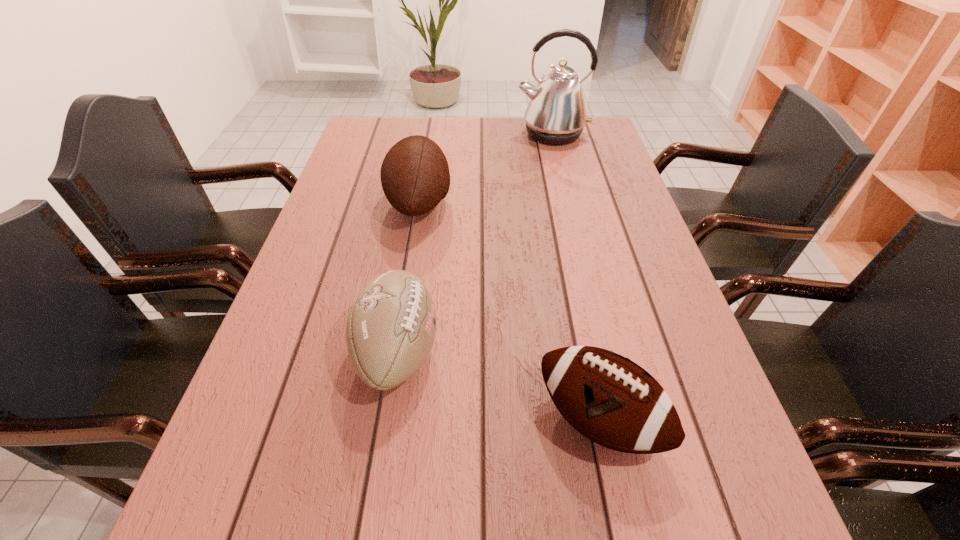
Identify the location of object present at the far right corner. The height and width of the screenshot is (540, 960). (556, 114).

You are a GUI agent. You are given a task and a screenshot of the screen. Output one action in this format:
    pyautogui.click(x=<x>, y=<y>)
    Task: Click on the free space at the far edge of the desktop
    This screenshot has height=540, width=960.
    Given the screenshot: What is the action you would take?
    point(519,146)

You are a GUI agent. You are given a task and a screenshot of the screen. Output one action in this format:
    pyautogui.click(x=<x>, y=<y>)
    Task: Click on the vacant area at the left edge of the desktop
    The image size is (960, 540).
    Given the screenshot: What is the action you would take?
    pyautogui.click(x=357, y=194)

Where is `free region at the right edge of the desktop`? This screenshot has height=540, width=960. free region at the right edge of the desktop is located at coordinates (657, 314).

You are a GUI agent. You are given a task and a screenshot of the screen. Output one action in this format:
    pyautogui.click(x=<x>, y=<y>)
    Task: Click on the vacant area that lies between the rightmost football (American) and the third nearest object
    This screenshot has height=540, width=960.
    Given the screenshot: What is the action you would take?
    [509, 312]

Where is `vacant space in between the rightmost football (American) and the tallest object`? The height and width of the screenshot is (540, 960). vacant space in between the rightmost football (American) and the tallest object is located at coordinates (575, 277).

Where is `object that is the third closest to the rightmost football (American)`? object that is the third closest to the rightmost football (American) is located at coordinates (556, 114).

You are a GUI agent. You are given a task and a screenshot of the screen. Output one action in this format:
    pyautogui.click(x=<x>, y=<y>)
    Task: Click on the closest object to the third nearest object
    The width and height of the screenshot is (960, 540).
    Given the screenshot: What is the action you would take?
    pyautogui.click(x=391, y=327)

Where is `football (American) that stands as the closest to the rightmost football (American)`? The width and height of the screenshot is (960, 540). football (American) that stands as the closest to the rightmost football (American) is located at coordinates (391, 327).

In order to click on football (American) that is the closest to the third nearest object in this screenshot , I will do `click(391, 327)`.